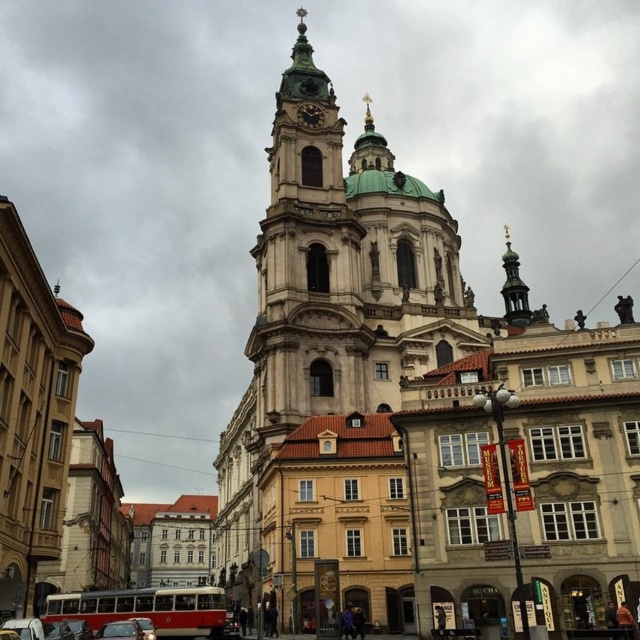
Question: Which point is farther to the camera?

Choices:
 (A) metallic silver car at lower left
 (B) red painted metal bus at lower left

Answer: (B)

Question: Which object is closer to the camera taking this photo?

Choices:
 (A) metallic silver car at lower left
 (B) red painted metal bus at lower left

Answer: (A)

Question: Which point appears farthest from the camera in this image?

Choices:
 (A) 132,637
 (B) 202,628

Answer: (B)

Question: Can you confirm if red painted metal bus at lower left is positioned above metallic silver car at lower left?

Choices:
 (A) yes
 (B) no

Answer: (B)

Question: Can you confirm if red painted metal bus at lower left is thinner than metallic silver car at lower left?

Choices:
 (A) no
 (B) yes

Answer: (A)

Question: Is the position of red painted metal bus at lower left less distant than that of metallic silver car at lower left?

Choices:
 (A) no
 (B) yes

Answer: (A)